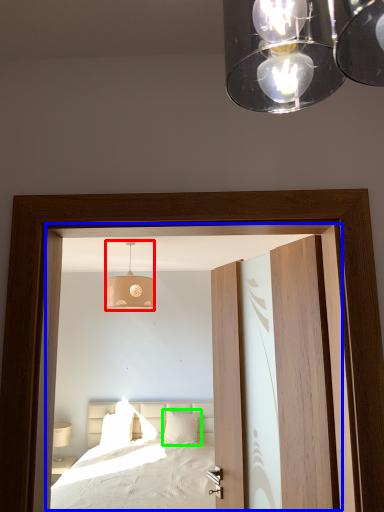
Question: Estimate the real-world distances between objects in this image. Which object is closer to lamp (highlighted by a red box), window (highlighted by a blue box) or pillow (highlighted by a green box)?

Choices:
 (A) window
 (B) pillow

Answer: (A)